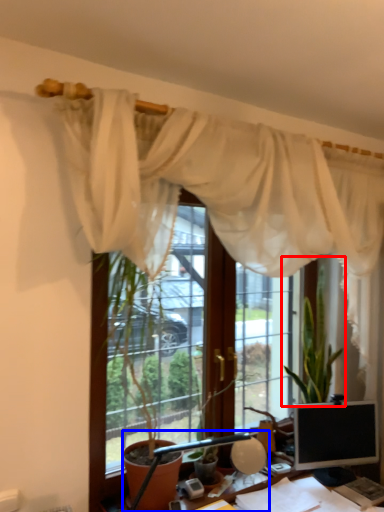
Question: Which object is closer to the camera taking this photo, houseplant (highlighted by a red box) or table lamp (highlighted by a blue box)?

Choices:
 (A) houseplant
 (B) table lamp

Answer: (B)